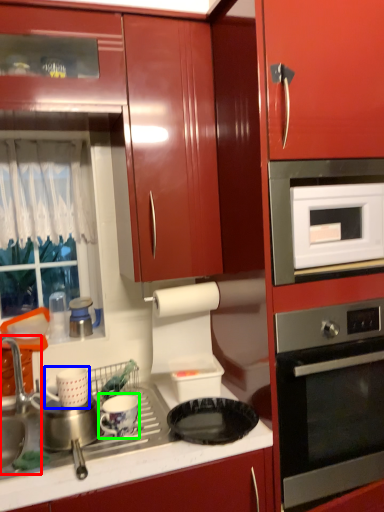
Question: Estimate the real-world distances between objects in this image. Which object is farther from sink (highlighted by a red box), appliance (highlighted by a blue box) or appliance (highlighted by a green box)?

Choices:
 (A) appliance
 (B) appliance

Answer: (B)